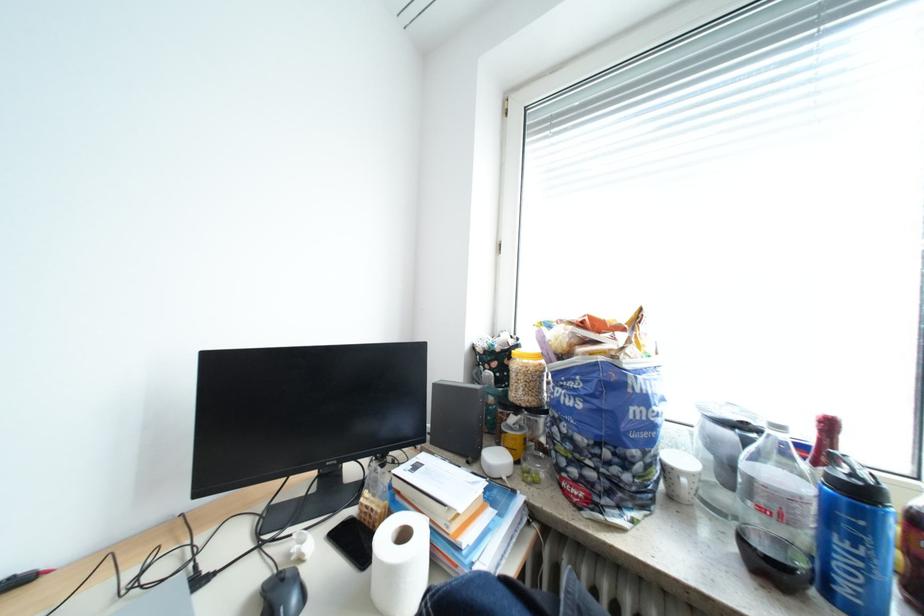
Where would you lift the small black bowl? Please return your answer as a coordinate pair (x, y).

(773, 559)